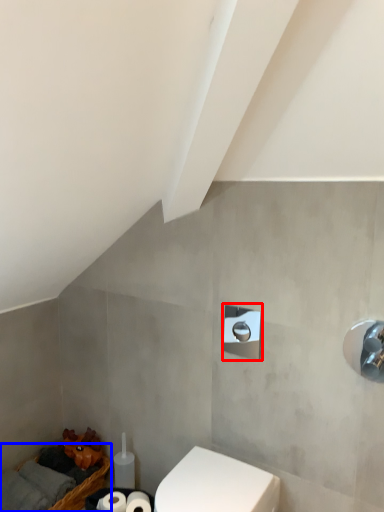
Question: Which of the following is the farthest to the observer, shower (highlighted by a red box) or basket (highlighted by a blue box)?

Choices:
 (A) shower
 (B) basket

Answer: (B)